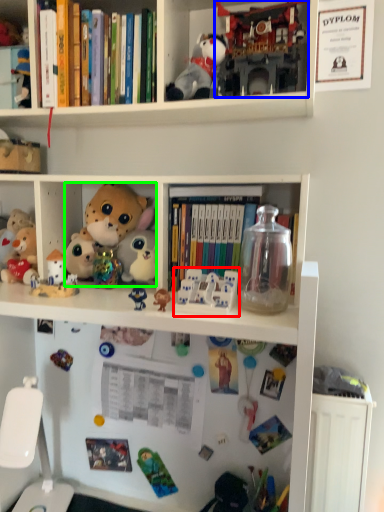
Question: Considering the real-world distances, which object is closest to toy (highlighted by a red box)? toy (highlighted by a blue box) or toy (highlighted by a green box).

Choices:
 (A) toy
 (B) toy

Answer: (B)